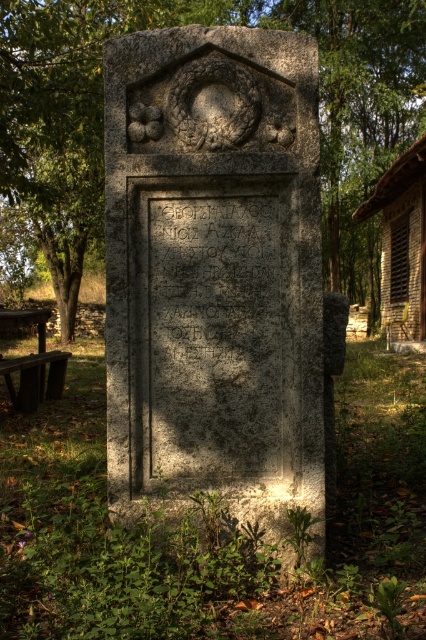
Question: Which point appears farthest from the camera in this image?

Choices:
 (A) (51, 368)
 (B) (402, 182)

Answer: (B)

Question: Is gray stone monument at center thinner than dark brown wooden picnic table at lower left?

Choices:
 (A) yes
 (B) no

Answer: (B)

Question: Can you confirm if wooden planks hut at right is smaller than dark brown wooden picnic table at lower left?

Choices:
 (A) yes
 (B) no

Answer: (A)

Question: Among these points, which one is farthest from the camera?

Choices:
 (A) (95, 182)
 (B) (192, 180)
 (C) (40, 324)
 (D) (417, 289)

Answer: (A)

Question: Can you confirm if gray stone monument at center is positioned to the left of dark brown wooden picnic table at lower left?

Choices:
 (A) yes
 (B) no

Answer: (B)

Question: Among these points, which one is farthest from the camera?

Choices:
 (A) (85, 92)
 (B) (316, 45)
 (C) (382, 218)

Answer: (C)